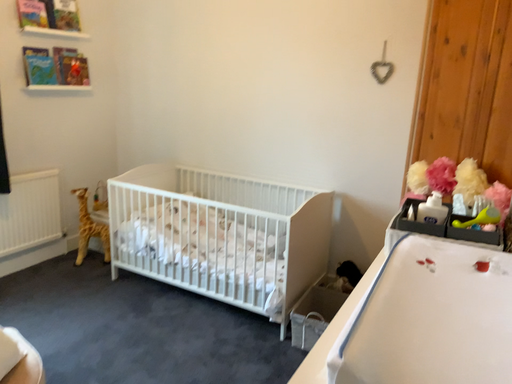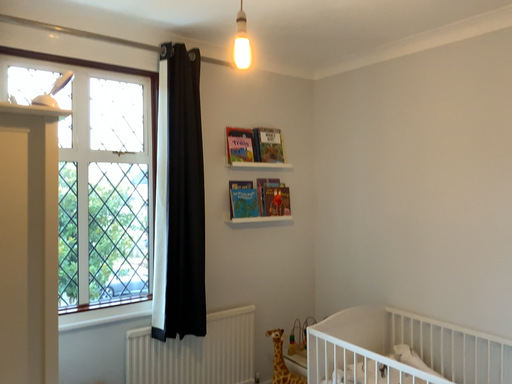
Question: How did the camera likely rotate when shooting the video?

Choices:
 (A) rotated left
 (B) rotated right

Answer: (A)